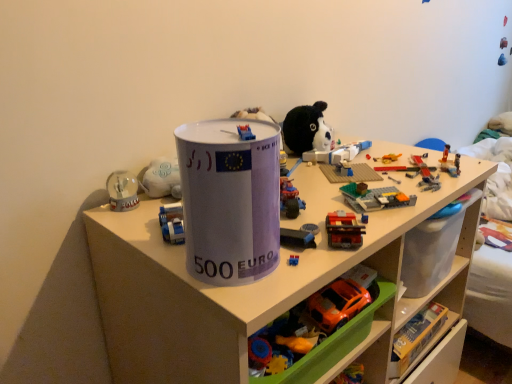
You are a GUI agent. You are given a task and a screenshot of the screen. Output one action in this format:
    pyautogui.click(x=<x>, y=<y>)
    Task: Click on the vacant space to the right of white paper cup at center
    This screenshot has width=512, height=384.
    Given the screenshot: What is the action you would take?
    pyautogui.click(x=316, y=252)